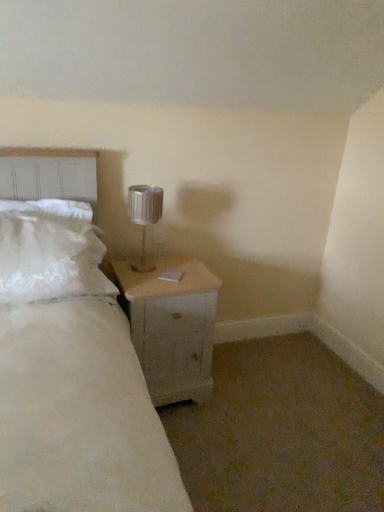
Question: Do you think white wood nightstand at lower right is within metallic silver lamp at upper right, or outside of it?

Choices:
 (A) inside
 (B) outside

Answer: (B)

Question: From the image's perspective, is white wood nightstand at lower right located above or below metallic silver lamp at upper right?

Choices:
 (A) below
 (B) above

Answer: (A)

Question: Estimate the real-world distances between objects in this image. Which object is farther from the white fluffy pillow at left?

Choices:
 (A) metallic silver lamp at upper right
 (B) white wood nightstand at lower right

Answer: (A)

Question: Which of these objects is positioned closest to the white fluffy pillow at left?

Choices:
 (A) metallic silver lamp at upper right
 (B) white wood nightstand at lower right

Answer: (B)